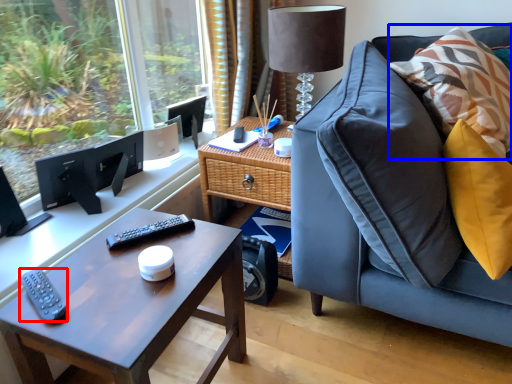
Question: Which object appears closest to the camera in this image, remote (highlighted by a red box) or pillow (highlighted by a blue box)?

Choices:
 (A) remote
 (B) pillow

Answer: (A)